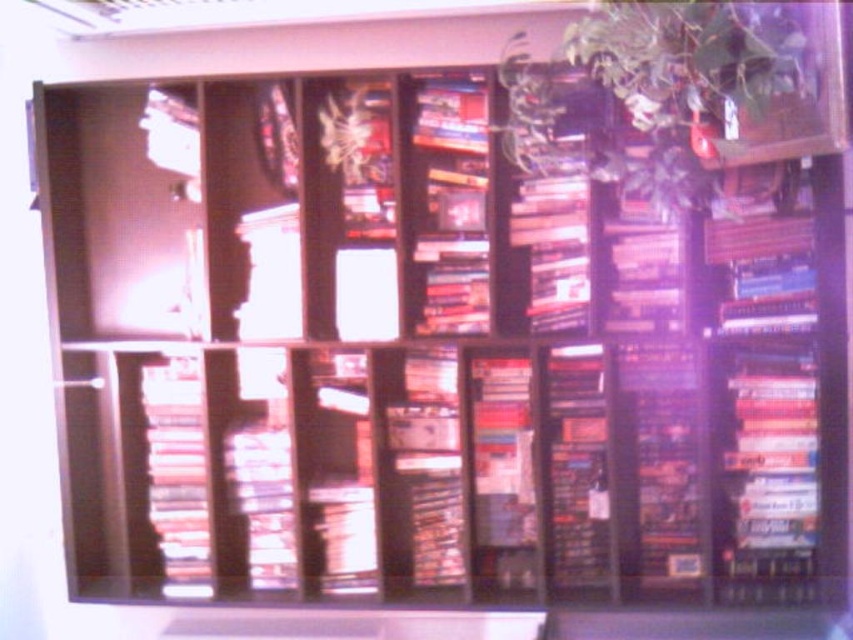
Question: Considering the relative positions of green leafy plant at upper right and matte plastic books at left in the image provided, where is green leafy plant at upper right located with respect to matte plastic books at left?

Choices:
 (A) right
 (B) left

Answer: (A)

Question: Which of these objects is positioned closest to the matte plastic books at left?

Choices:
 (A) green leafy plant at upper right
 (B) hardcover book at right
 (C) matte white statue at center

Answer: (C)

Question: Can you confirm if hardcover book at right is bigger than matte white statue at center?

Choices:
 (A) no
 (B) yes

Answer: (B)

Question: Can you confirm if green leafy plant at upper right is positioned to the left of matte white statue at center?

Choices:
 (A) no
 (B) yes

Answer: (A)

Question: Which point is closer to the camera taking this photo?

Choices:
 (A) (814, 422)
 (B) (692, 120)
 (C) (247, 275)

Answer: (B)

Question: Based on their relative distances, which object is nearer to the matte white statue at center?

Choices:
 (A) green leafy plant at upper right
 (B) matte plastic books at left
 (C) hardcover book at right

Answer: (B)